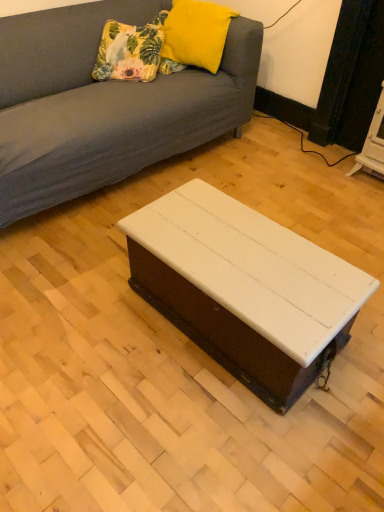
At what (x,y) coordinates should I click in order to perform the action: click on vacant area on top of white painted wood coffee table at center (from a real-world perspective). Please return your answer as a coordinate pair (x, y). The width and height of the screenshot is (384, 512). Looking at the image, I should click on (271, 264).